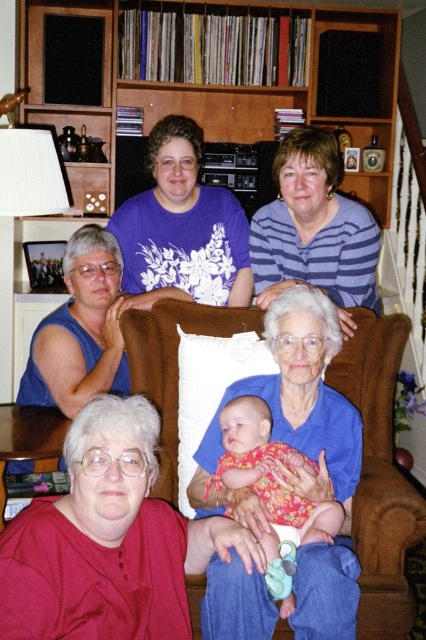
Does point (127, 536) come closer to viewer compared to point (276, 234)?

Yes, it is.

Is matte red blouse at lower left bigger than blue striped shirt at upper center?

No.

Between point (134, 604) and point (376, 250), which one is positioned in front?

Positioned in front is point (134, 604).

At what (x,y) coordinates should I click in order to perform the action: click on matte red blouse at lower left. Please return your answer as a coordinate pair (x, y). Looking at the image, I should click on (109, 540).

Is blue fabric at center to the left of blue striped shirt at upper center from the viewer's perspective?

Correct, you'll find blue fabric at center to the left of blue striped shirt at upper center.

Is point (241, 602) positioned before point (370, 292)?

Yes, point (241, 602) is in front of point (370, 292).

Between point (328, 301) and point (308, 198), which one is positioned in front?

Point (328, 301) is more forward.

The image size is (426, 640). Identify the location of blue fabric at center. (291, 413).

Can you confirm if purple floral shirt at upper center is shorter than blue striped shirt at upper center?

Yes.

This screenshot has height=640, width=426. What are the coordinates of `purple floral shirt at upper center` in the screenshot? It's located at (183, 225).

Who is more forward, (x=146, y=257) or (x=255, y=291)?

Point (x=146, y=257) is more forward.

You are a GUI agent. You are given a task and a screenshot of the screen. Output one action in this format:
    pyautogui.click(x=<x>, y=<y>)
    Task: Click on the purple floral shirt at upper center
    
    Given the screenshot: What is the action you would take?
    pyautogui.click(x=183, y=225)